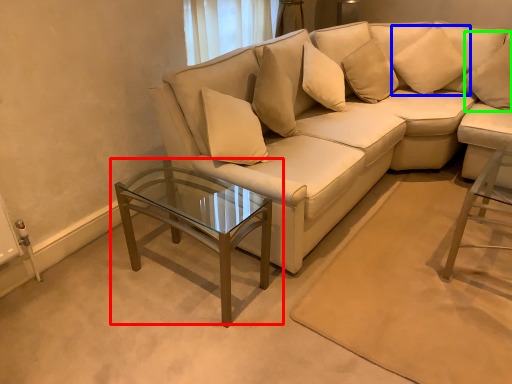
Question: Which object is positioned closest to coffee table (highlighted by a red box)? Select from pillow (highlighted by a blue box) and pillow (highlighted by a green box).

Choices:
 (A) pillow
 (B) pillow

Answer: (A)